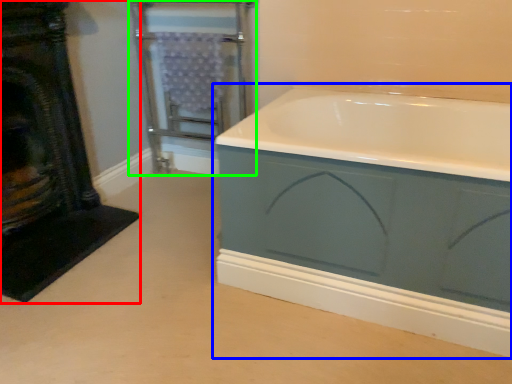
Question: Which object is the closest to the fireplace (highlighted by a red box)? Choose among these: bathtub (highlighted by a blue box) or screen door (highlighted by a green box).

Choices:
 (A) bathtub
 (B) screen door

Answer: (B)